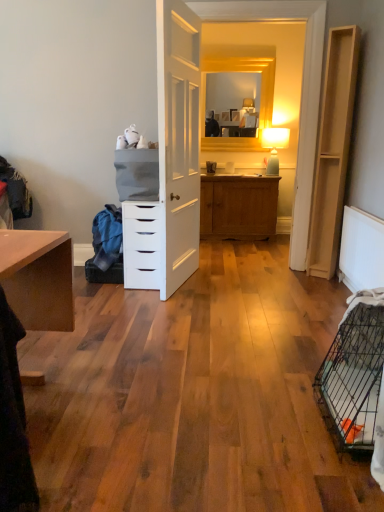
You are a GUI agent. You are given a task and a screenshot of the screen. Output one action in this format:
    pyautogui.click(x=<x>, y=<y>)
    Task: Click on the vacant space that is in between white matte chest of drawers at center and black wire birdcage at lower right
    
    Given the screenshot: What is the action you would take?
    pyautogui.click(x=227, y=335)